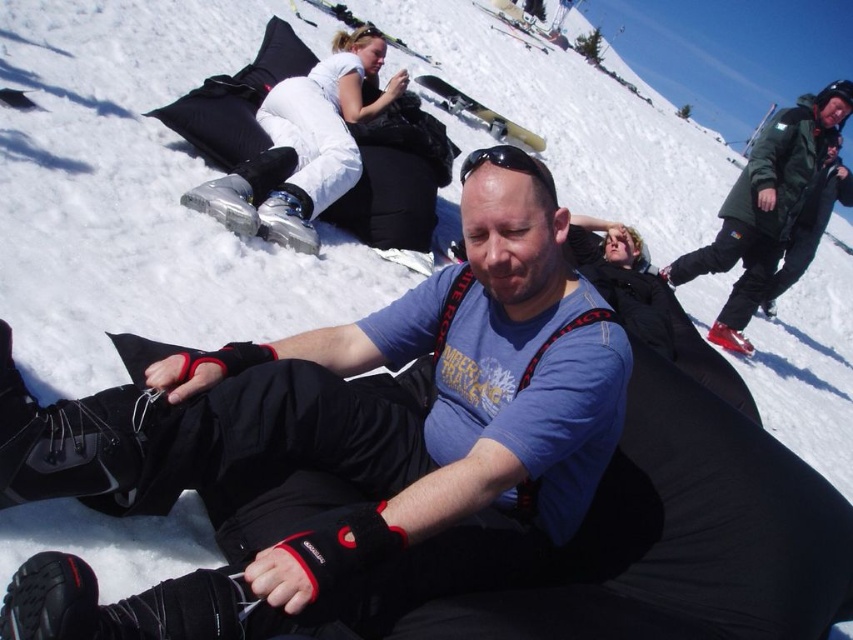
Is matte black gloves at center thinner than green matte jacket at upper right?

Correct, matte black gloves at center's width is less than green matte jacket at upper right's.

In the scene shown: Is matte black gloves at center smaller than green matte jacket at upper right?

Indeed, matte black gloves at center has a smaller size compared to green matte jacket at upper right.

Is point (402, 352) in front of point (845, 102)?

Yes, point (402, 352) is in front of point (845, 102).

The image size is (853, 640). What are the coordinates of `matte black gloves at center` in the screenshot? It's located at (x=347, y=438).